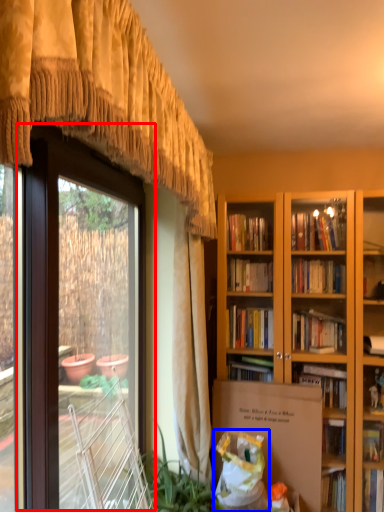
Question: Which of the following is the farthest to the observer, screen door (highlighted by a red box) or shopping bag (highlighted by a blue box)?

Choices:
 (A) screen door
 (B) shopping bag

Answer: (B)